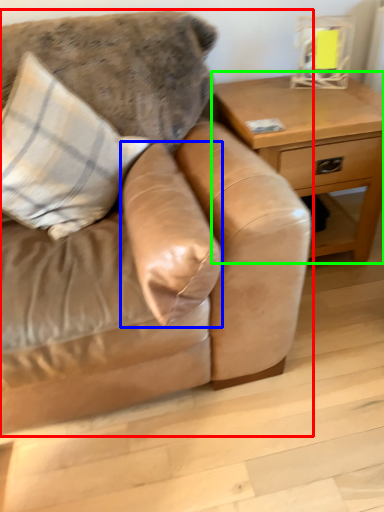
Question: Which is nearer to the studio couch (highlighted by a red box)? pillow (highlighted by a blue box) or table (highlighted by a green box).

Choices:
 (A) pillow
 (B) table

Answer: (A)